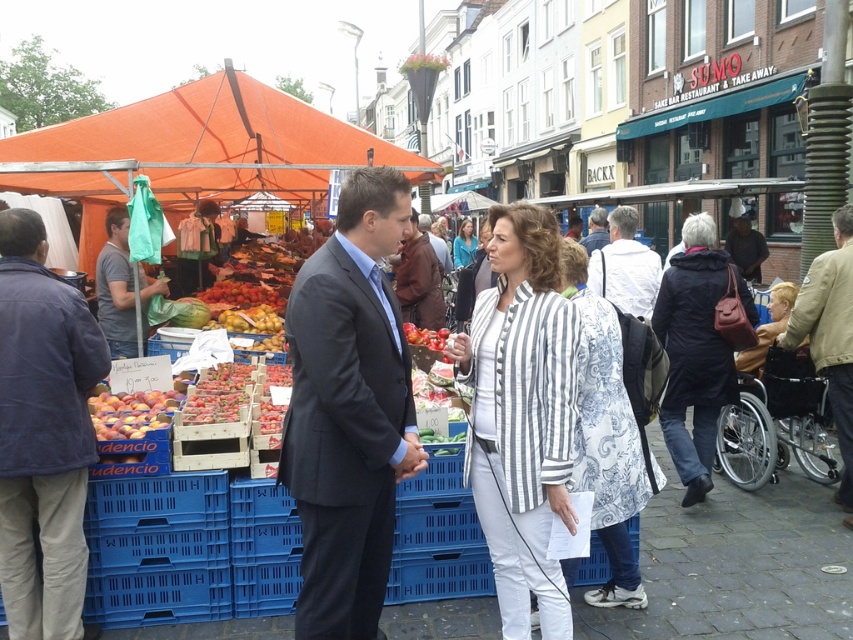
Is point (120, 410) positioned behind point (408, 332)?

No, (120, 410) is in front of (408, 332).

From the picture: Is matte peach at center bigger than shiny red tomatoes at center?

Indeed, matte peach at center has a larger size compared to shiny red tomatoes at center.

Image resolution: width=853 pixels, height=640 pixels. I want to click on matte peach at center, so click(x=131, y=412).

Does orange fabric canopy at upper left have a larger size compared to dark blue suit at center?

Correct, orange fabric canopy at upper left is larger in size than dark blue suit at center.

Where is `orange fabric canopy at upper left`? The image size is (853, 640). orange fabric canopy at upper left is located at coordinates (218, 141).

Which is behind, point (199, 124) or point (418, 225)?

Point (418, 225)

This screenshot has width=853, height=640. What are the coordinates of `orange fabric canopy at upper left` in the screenshot? It's located at (218, 141).

Describe the element at coordinates (695, 349) in the screenshot. I see `dark blue coat at center` at that location.

Is point (677, 320) closer to viewer compared to point (248, 284)?

Yes, point (677, 320) is closer to viewer.

Image resolution: width=853 pixels, height=640 pixels. Identify the location of dark blue coat at center. (695, 349).